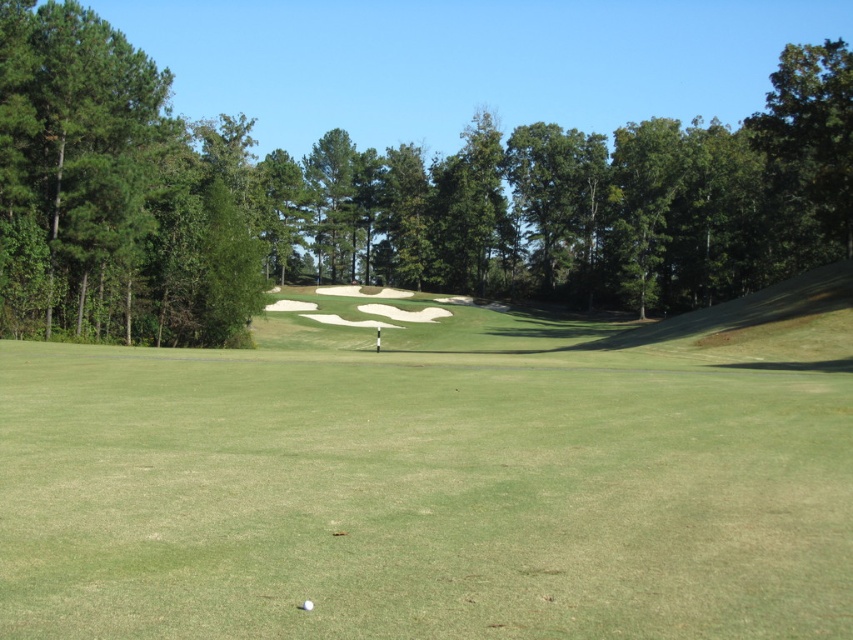
You are a golfer standing on the green grassy field at center and want to hit the golf ball to the green leafy tree at center. Considering the height difference between them, will the golf ball reach the tree without any obstruction?

The green grassy field at center is shorter than the green leafy tree at center, so the golf ball can reach the tree without obstruction as the tree is taller and there is no mention of other obstacles between them.